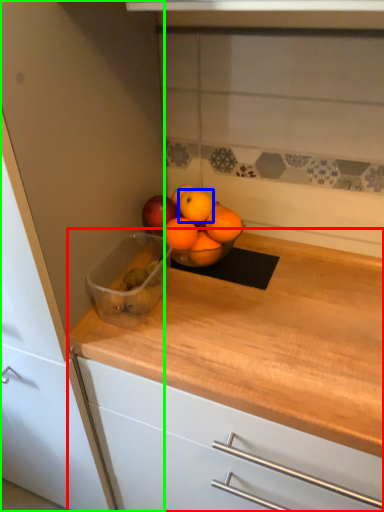
Question: Estimate the real-world distances between objects in this image. Which object is closer to countertop (highlighted by a red box), orange (highlighted by a blue box) or cabinetry (highlighted by a green box)?

Choices:
 (A) orange
 (B) cabinetry

Answer: (B)